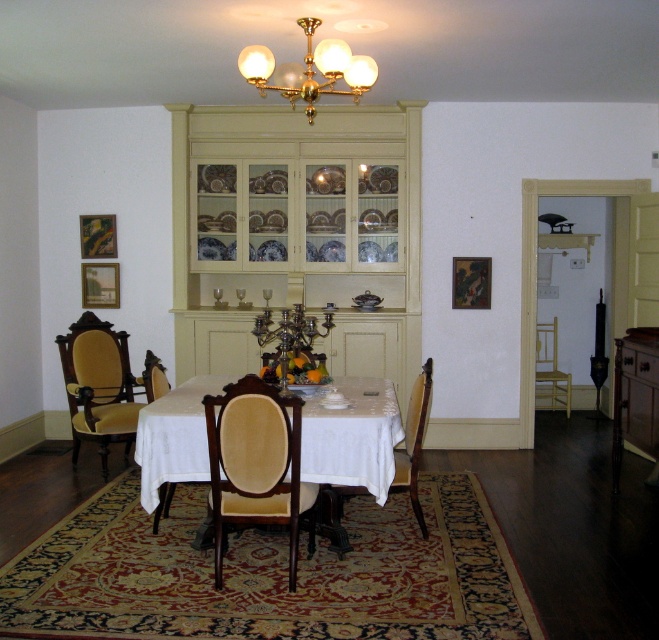
Between velvet upholstered chair at left and gold brass chandelier at upper center, which one has less height?

Standing shorter between the two is gold brass chandelier at upper center.

Who is more forward, [92,416] or [264,67]?

Point [264,67] is more forward.

The image size is (659, 640). What do you see at coordinates (100, 385) in the screenshot? I see `velvet upholstered chair at left` at bounding box center [100, 385].

In order to click on velvet upholstered chair at left in this screenshot , I will do `click(100, 385)`.

Find the location of `white cloth-covered table at center`. white cloth-covered table at center is located at coordinates (353, 436).

Consider the image. Who is shorter, white cloth-covered table at center or velvet upholstered chair at left?

white cloth-covered table at center is shorter.

Is point (150, 476) more distant than point (76, 426)?

No, it is in front of (76, 426).

Find the location of a particular element. white cloth-covered table at center is located at coordinates (353, 436).

Does velvet upholstered chair at center appear under gold brass chandelier at upper center?

Correct, velvet upholstered chair at center is located below gold brass chandelier at upper center.

Who is more distant from viewer, (250,416) or (262,54)?

Positioned behind is point (262,54).

The image size is (659, 640). What do you see at coordinates (256, 465) in the screenshot?
I see `velvet upholstered chair at center` at bounding box center [256, 465].

Locate an element on the screen. The height and width of the screenshot is (640, 659). velvet upholstered chair at center is located at coordinates (256, 465).